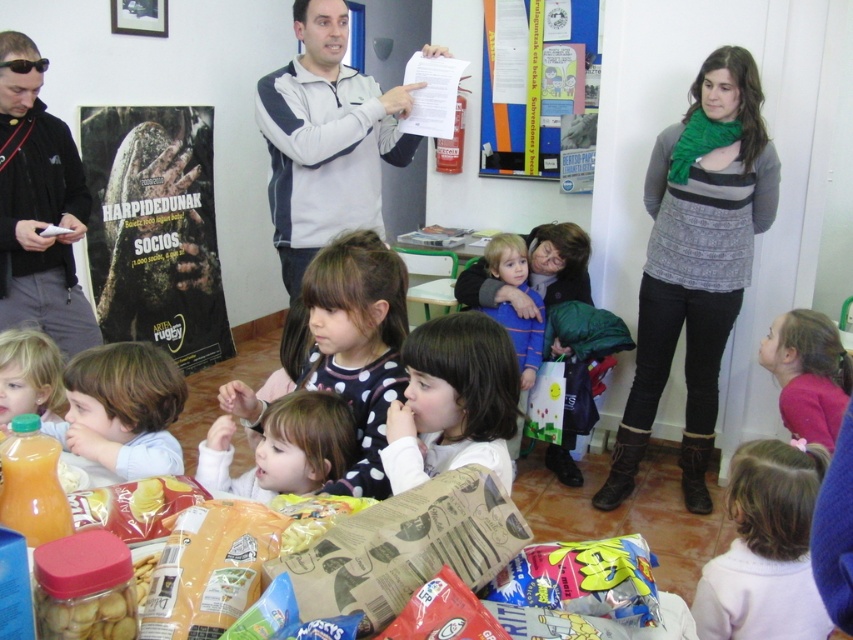
You are standing in the classroom and want to hang a picture exactly where the green knitted scarf at upper right is currently located. What coordinates should you use?

The green knitted scarf at upper right is located at coordinates point (695, 262), so you should hang the picture there.

You are organizing a small event and need to decide which item to place in a gift basket. The basket has limited space. Which item between the green knitted scarf at upper right and the translucent plastic bottle of orange juice at lower left would you choose based on their sizes?

The green knitted scarf at upper right has a larger size compared to the translucent plastic bottle of orange juice at lower left, so it would take up more space in the basket. Therefore, the translucent plastic bottle of orange juice at lower left would be the better choice if space is limited.

You are a child sitting at the table and want to reach the smooth orange juice at lower left and the smooth beige shirt at center. Which one is closer to your left side?

The smooth orange juice at lower left is to the left of smooth beige shirt at center, so it is closer to your left side.